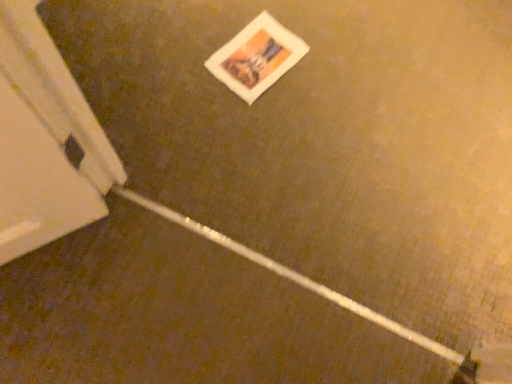
Where is `white glossy pole at lower center`? white glossy pole at lower center is located at coordinates (291, 275).

The width and height of the screenshot is (512, 384). What do you see at coordinates (291, 275) in the screenshot? I see `white glossy pole at lower center` at bounding box center [291, 275].

In order to face white glossy pole at lower center, should I rotate leftwards or rightwards?

Rotate your view left by about 5.593°.

You are a GUI agent. You are given a task and a screenshot of the screen. Output one action in this format:
    pyautogui.click(x=<x>, y=<y>)
    Task: Click on the white glossy pole at lower center
    This screenshot has height=384, width=512.
    Given the screenshot: What is the action you would take?
    pyautogui.click(x=291, y=275)